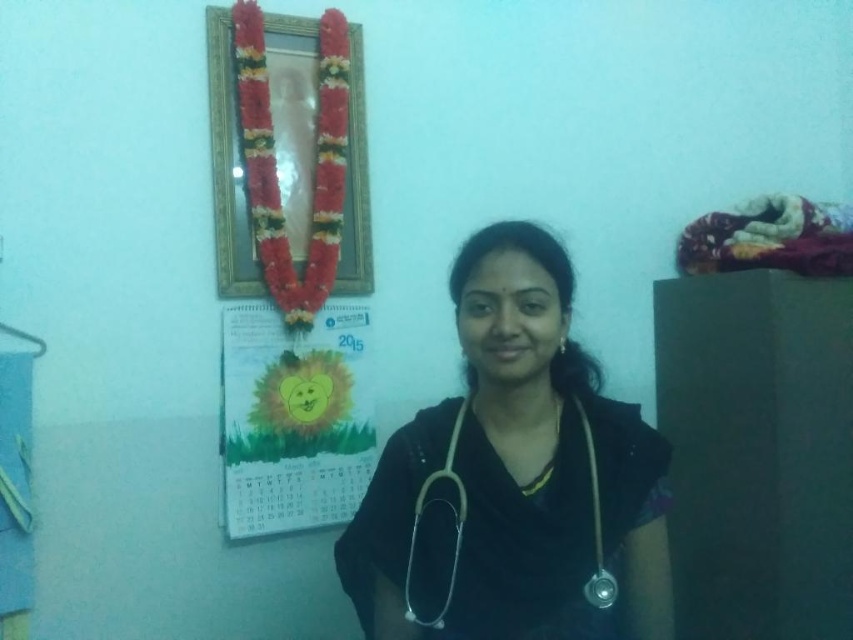
Which is in front, point (508, 582) or point (230, 136)?

Positioned in front is point (508, 582).

Does point (503, 442) come behind point (219, 92)?

That is False.

In order to click on black fabric stethoscope at center in this screenshot , I will do `click(514, 477)`.

Who is taller, paper calendar at upper center or gold metallic frame at upper center?

gold metallic frame at upper center is taller.

Which is more to the left, paper calendar at upper center or gold metallic frame at upper center?

From the viewer's perspective, gold metallic frame at upper center appears more on the left side.

Which is in front, point (230, 467) or point (354, 122)?

Point (230, 467) is more forward.

You are a GUI agent. You are given a task and a screenshot of the screen. Output one action in this format:
    pyautogui.click(x=<x>, y=<y>)
    Task: Click on the paper calendar at upper center
    The image size is (853, 640).
    Given the screenshot: What is the action you would take?
    pyautogui.click(x=294, y=419)

Does paper calendar at upper center come in front of metallic silver stethoscope at center?

No.

Is paper calendar at upper center to the right of metallic silver stethoscope at center from the viewer's perspective?

No, paper calendar at upper center is not to the right of metallic silver stethoscope at center.

Who is more forward, (329, 348) or (590, 476)?

Positioned in front is point (590, 476).

Find the location of `paper calendar at upper center`. paper calendar at upper center is located at coordinates (294, 419).